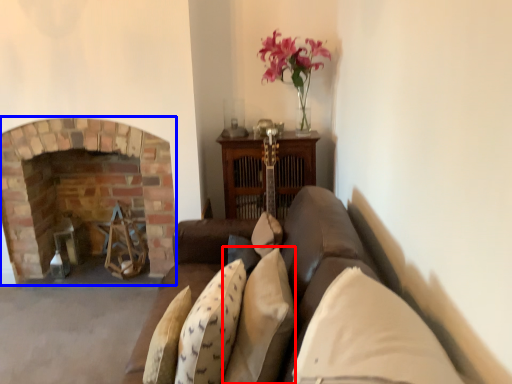
Question: Which object appears closest to the camera in this image, pillow (highlighted by a red box) or fireplace (highlighted by a blue box)?

Choices:
 (A) pillow
 (B) fireplace

Answer: (A)